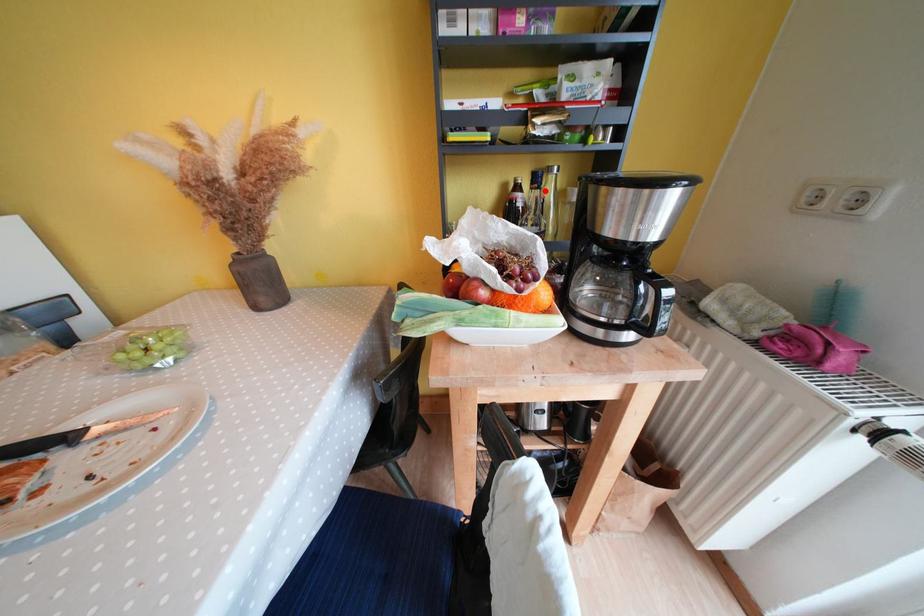
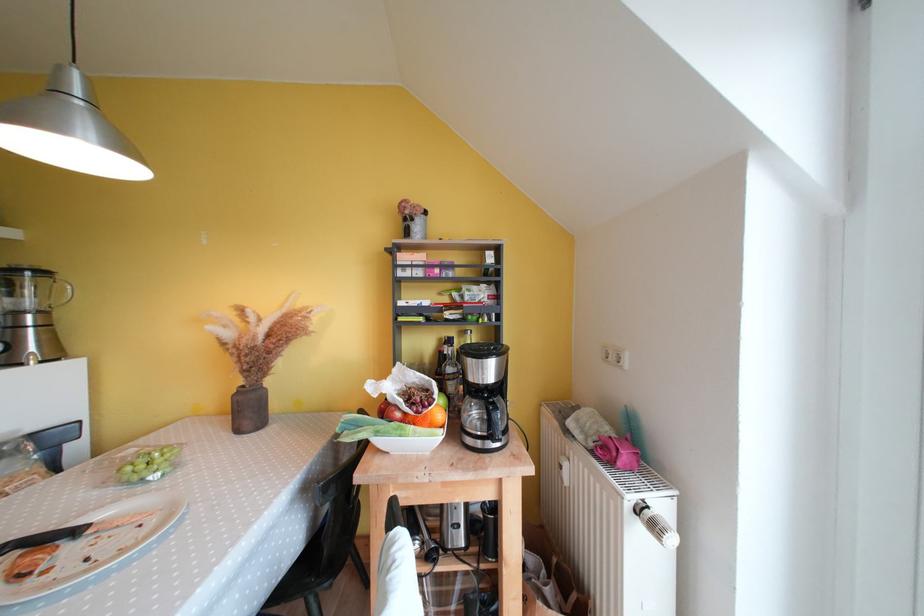
In the second image, find the point that corresponds to the highlighted location in the first image.

(457, 350)